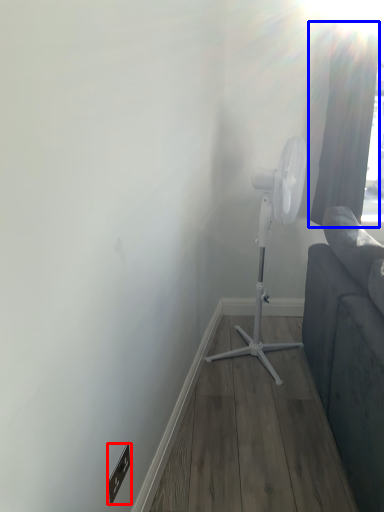
Question: Which object is closer to the camera taking this photo, electric outlet (highlighted by a red box) or curtain (highlighted by a blue box)?

Choices:
 (A) electric outlet
 (B) curtain

Answer: (A)